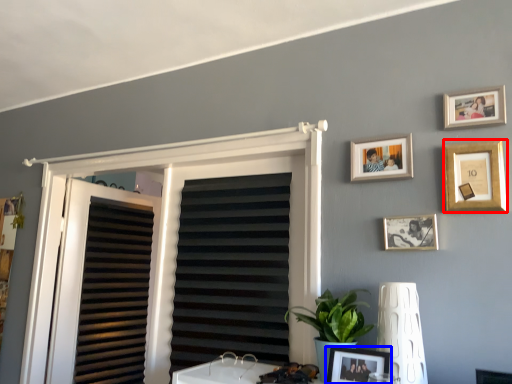
Question: Which point is closer to the camera, picture frame (highlighted by a red box) or picture frame (highlighted by a blue box)?

Choices:
 (A) picture frame
 (B) picture frame

Answer: (B)